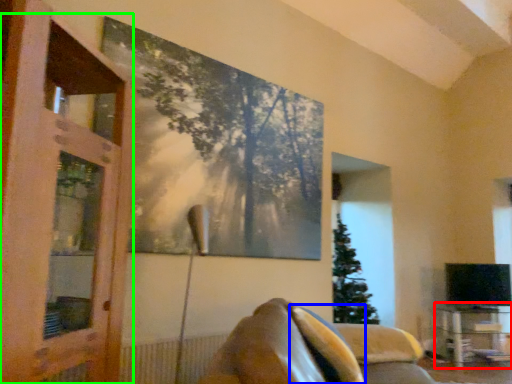
Question: Which object is positioned closest to table (highlighted by a red box)? Select from pillow (highlighted by a blue box) and screen door (highlighted by a green box).

Choices:
 (A) pillow
 (B) screen door

Answer: (A)